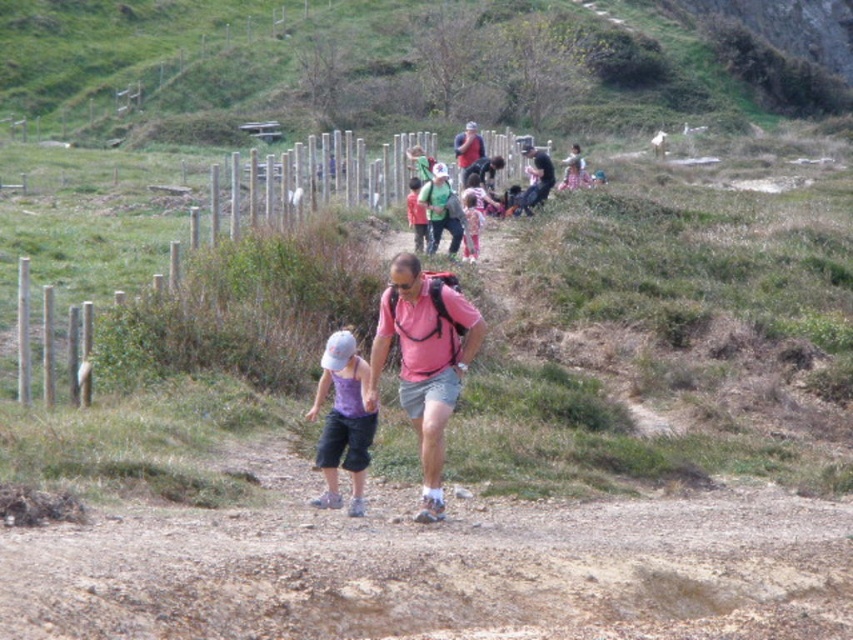
You are a photographer trying to capture a group shot of the two hikers at the center of the image. The matte pink shirt at center and the light purple fabric shirt at center. You want to ensure both are clearly visible in the frame. Given their sizes, which hiker should you position closer to the camera to maintain balance in the composition?

The matte pink shirt at center has a larger width than the light purple fabric shirt at center. To maintain balance in the composition, position the light purple fabric shirt at center closer to the camera so that its apparent size matches the matte pink shirt at center.